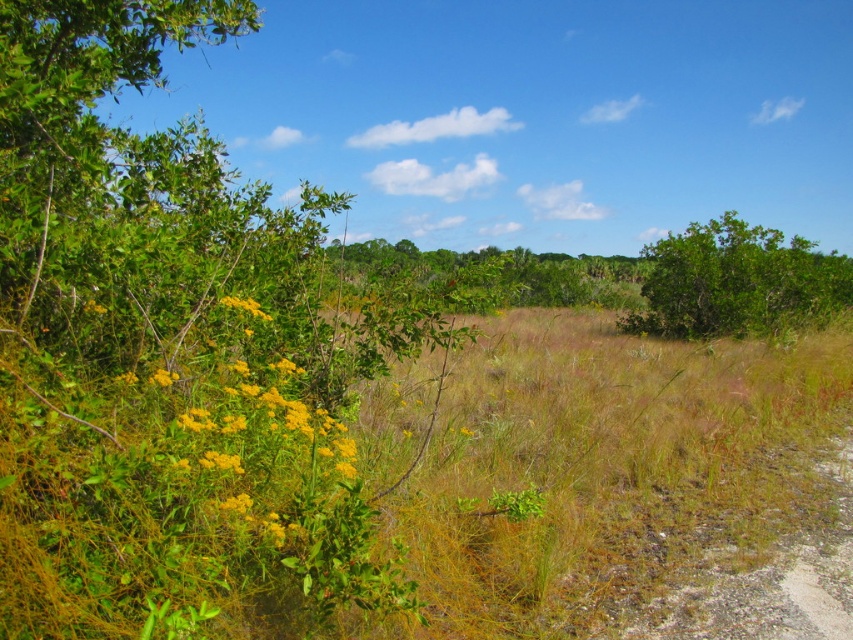
You are a gardener who needs to water two plants in the image. The yellow matte flowers at left require a watering can that can hold up to 50 feet of water, and the green leafy bush at upper right needs a hose that can reach 40 feet. Do you have the right tools to water both plants from your current position?

The yellow matte flowers at left and green leafy bush at upper right are 45.42 feet apart from each other. Since the watering can can hold up to 50 feet of water, it can reach the yellow matte flowers at left. However, the hose can only reach 40 feet, which is shorter than the distance to the green leafy bush at upper right. Therefore, you do not have the right tools to water both plants from your current position.

You are a gardener planning to water the yellow matte flowers at left and the green leafy bush at upper right. Which of these two plants is positioned more to the east if the image is oriented with the sun coming from the west?

The yellow matte flowers at left is positioned more to the east since it is to the left of the green leafy bush at upper right, and the sun is coming from the west.